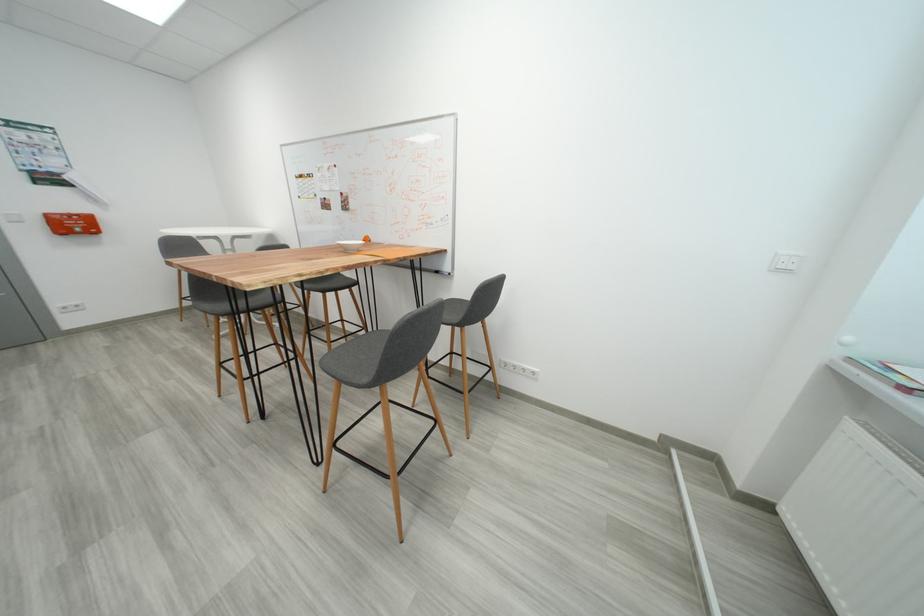
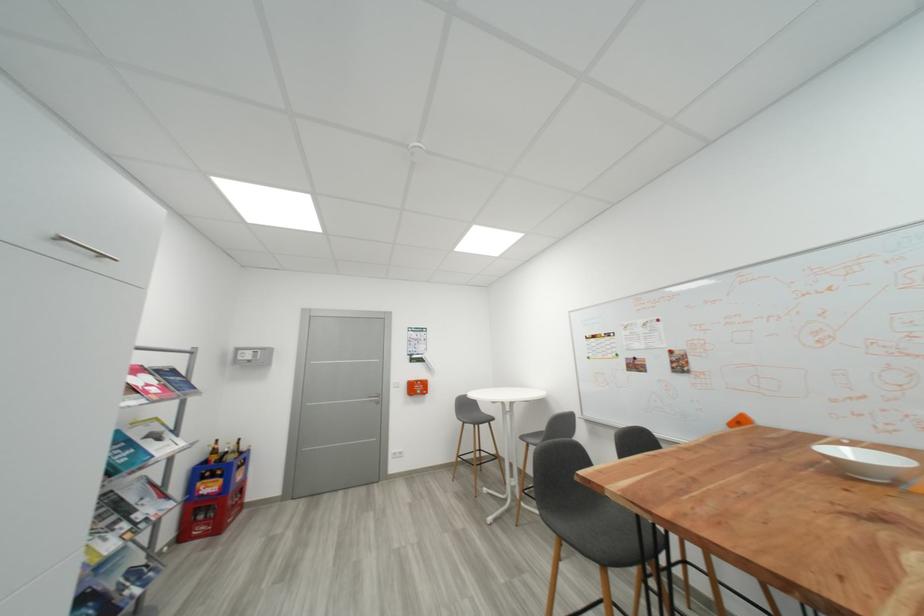
The point at (191, 331) is marked in the first image. Where is the corresponding point in the second image?

(465, 496)